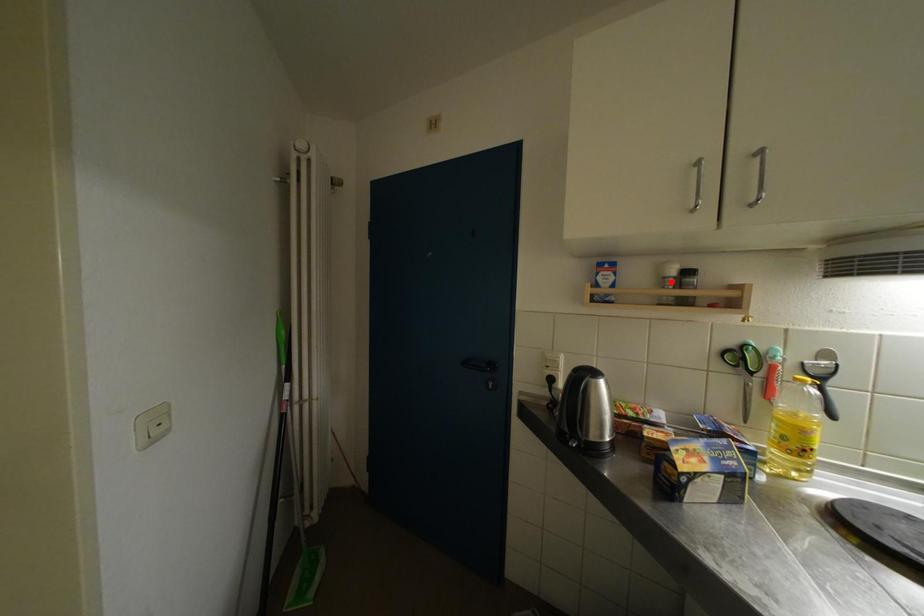
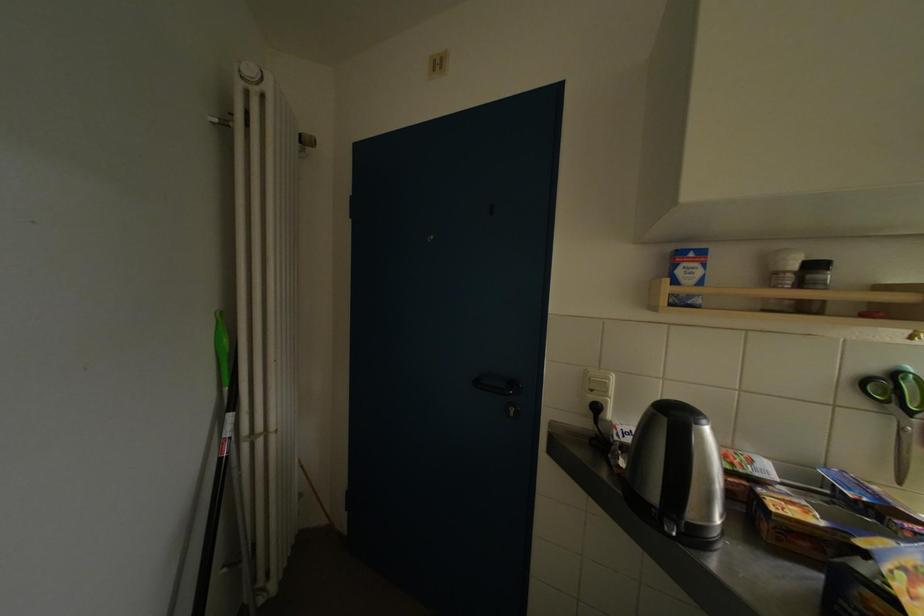
In the second image, find the point that corresponds to the highlighted location in the first image.

(784, 277)